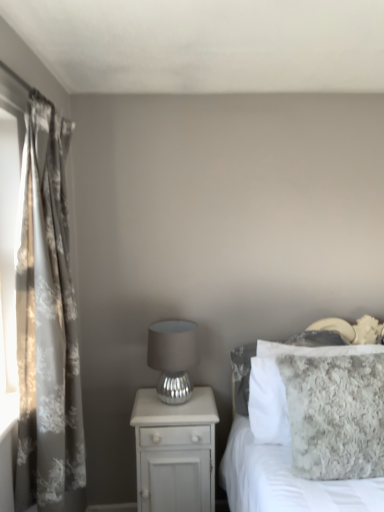
Question: Is fuzzy gray blanket at right taller than floral-patterned fabric curtain at left?

Choices:
 (A) no
 (B) yes

Answer: (A)

Question: Is fuzzy gray blanket at right turned away from floral-patterned fabric curtain at left?

Choices:
 (A) yes
 (B) no

Answer: (B)

Question: Are fuzzy gray blanket at right and floral-patterned fabric curtain at left beside each other?

Choices:
 (A) yes
 (B) no

Answer: (B)

Question: Can you confirm if fuzzy gray blanket at right is positioned to the right of floral-patterned fabric curtain at left?

Choices:
 (A) no
 (B) yes

Answer: (B)

Question: Does fuzzy gray blanket at right have a larger size compared to floral-patterned fabric curtain at left?

Choices:
 (A) no
 (B) yes

Answer: (B)

Question: Is fuzzy gray blanket at right inside the boundaries of floral-patterned fabric curtain at left, or outside?

Choices:
 (A) inside
 (B) outside

Answer: (B)

Question: From a real-world perspective, is fuzzy gray blanket at right above or below floral-patterned fabric curtain at left?

Choices:
 (A) below
 (B) above

Answer: (A)

Question: Considering the positions of fuzzy gray blanket at right and floral-patterned fabric curtain at left in the image, is fuzzy gray blanket at right wider or thinner than floral-patterned fabric curtain at left?

Choices:
 (A) wide
 (B) thin

Answer: (A)

Question: Is fuzzy gray blanket at right in front of or behind floral-patterned fabric curtain at left in the image?

Choices:
 (A) front
 (B) behind

Answer: (A)

Question: From a real-world perspective, is matte silver table lamp at center physically located above or below fuzzy gray blanket at right?

Choices:
 (A) above
 (B) below

Answer: (A)

Question: In the image, is matte silver table lamp at center on the left side or the right side of fuzzy gray blanket at right?

Choices:
 (A) left
 (B) right

Answer: (A)

Question: Is matte silver table lamp at center situated inside fuzzy gray blanket at right or outside?

Choices:
 (A) outside
 (B) inside

Answer: (A)

Question: Is matte silver table lamp at center wider or thinner than fuzzy gray blanket at right?

Choices:
 (A) thin
 (B) wide

Answer: (A)

Question: From a real-world perspective, is fuzzy gray blanket at right above or below matte silver table lamp at center?

Choices:
 (A) above
 (B) below

Answer: (B)

Question: Considering their positions, is fuzzy gray blanket at right located in front of or behind matte silver table lamp at center?

Choices:
 (A) front
 (B) behind

Answer: (A)